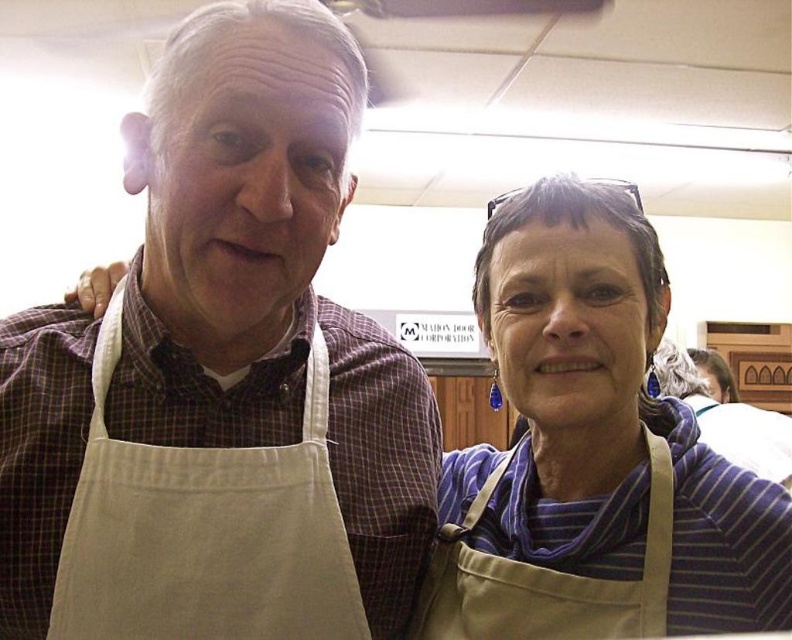
Who is higher up, matte beige apron at center or beige cotton apron at left?

matte beige apron at center is higher up.

Which is more to the right, matte beige apron at center or beige cotton apron at left?

matte beige apron at center

Who is more distant from viewer, [524,371] or [333,493]?

Point [524,371]

The image size is (792, 640). In order to click on matte beige apron at center in this screenshot , I will do `click(594, 452)`.

Is matte beige apron at center to the right of tan canvas apron at center from the viewer's perspective?

Yes, matte beige apron at center is to the right of tan canvas apron at center.

Which is below, matte beige apron at center or tan canvas apron at center?

Positioned lower is tan canvas apron at center.

Locate an element on the screen. This screenshot has width=792, height=640. matte beige apron at center is located at coordinates (594, 452).

Where is `matte beige apron at center`? This screenshot has height=640, width=792. matte beige apron at center is located at coordinates (594, 452).

Which is in front, point (204, 333) or point (254, 474)?

Point (254, 474) is more forward.

Does beige cotton apron at center appear under beige cotton apron at left?

No, beige cotton apron at center is not below beige cotton apron at left.

Is point (345, 628) positioned after point (109, 476)?

That is True.

The image size is (792, 640). In order to click on beige cotton apron at center in this screenshot , I will do `click(221, 376)`.